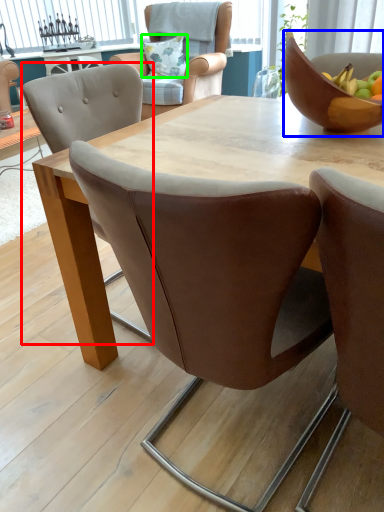
Question: Considering the real-world distances, which object is farthest from chair (highlighted by a red box)? bowl (highlighted by a blue box) or pillow (highlighted by a green box)?

Choices:
 (A) bowl
 (B) pillow

Answer: (B)